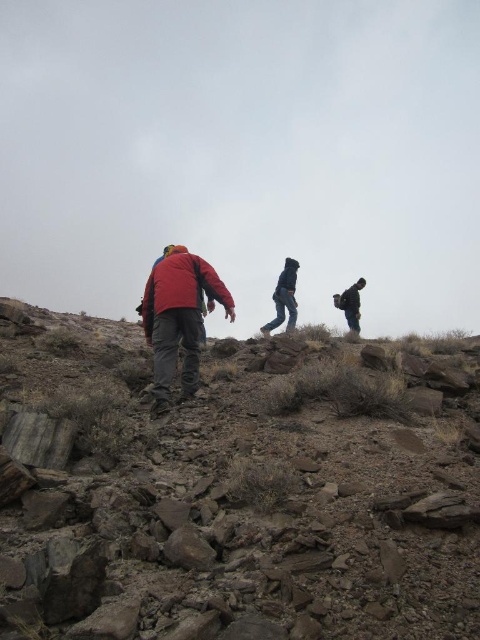
You are a hiker planning to take a photo of the red matte jacket at center and the rusty stone hillside at lower left. Which object should you position to the left side of your camera frame to capture both in the scene?

To capture both the red matte jacket at center and the rusty stone hillside at lower left in your photo, position the rusty stone hillside at lower left to the left side of your camera frame since it is already located to the left of the red matte jacket at center.

You are a hiker planning to take a shortcut between the red matte jacket at center and the dark gray fabric backpack at right. Which object should you approach first if you want to reach the higher ground first?

The dark gray fabric backpack at right is higher than the red matte jacket at center, so you should approach the dark gray fabric backpack at right first to reach higher ground.

You are a hiker who needs to decide where to place your camping gear. You have a rusty stone hillside at lower left and a dark gray fabric backpack at right. Which object is bigger in size?

The rusty stone hillside at lower left is larger in size compared to the dark gray fabric backpack at right, so the camping gear should be placed near the larger rusty stone hillside at lower left.